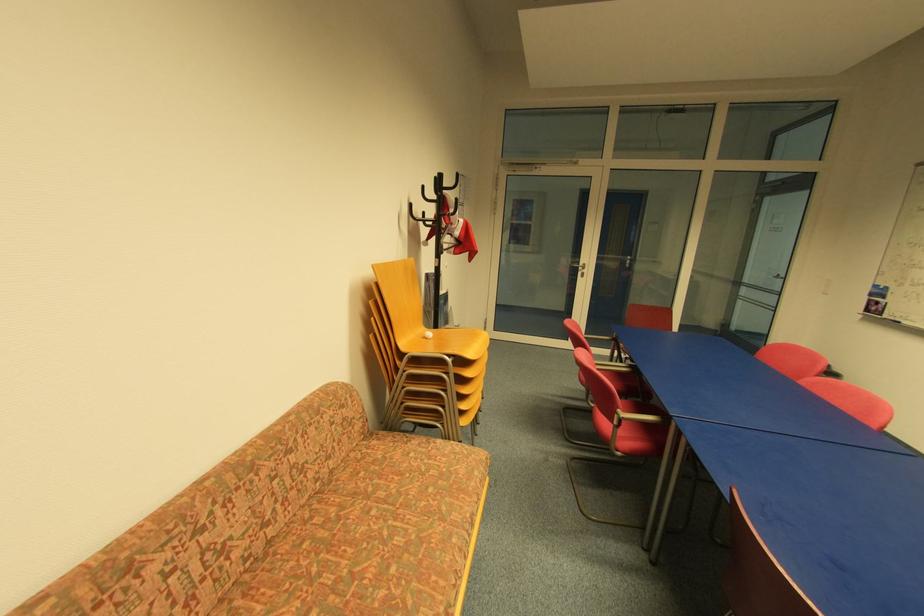
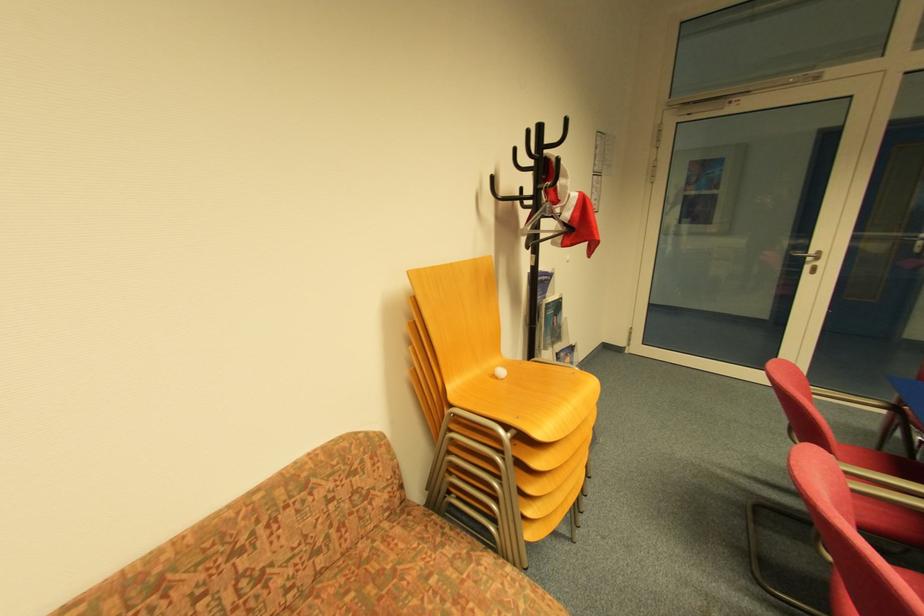
Question: The camera is either moving clockwise (left) or counter-clockwise (right) around the object. The first image is from the beginning of the video and the second image is from the end. Is the camera moving left or right when shooting the video?

Choices:
 (A) Left
 (B) Right

Answer: (B)